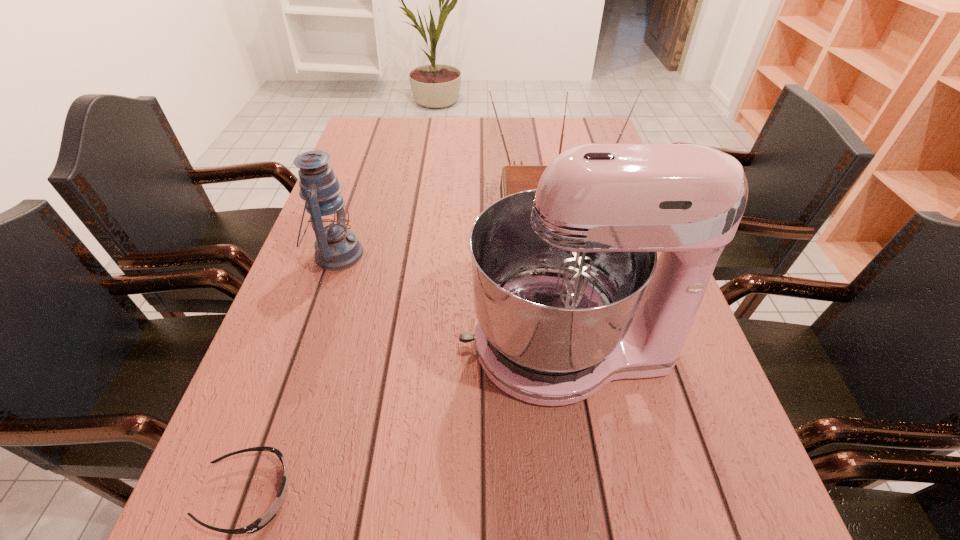
Find the location of a particular element. vacant point located between the nearest object and the radio_receiver is located at coordinates (400, 346).

Locate which object is the third closest to the lantern. Please provide its 2D coordinates. Your answer should be formatted as a tuple, i.e. [(x, y)], where the tuple contains the x and y coordinates of a point satisfying the conditions above.

[(260, 523)]

Find the location of `the closest object relative to the lantern`. the closest object relative to the lantern is located at coordinates (569, 295).

Identify the location of vacant region that satisfies the following two spatial constraints: 1. on the front panel of the radio_receiver; 2. on the front-facing side of the mixer. Image resolution: width=960 pixels, height=540 pixels. (581, 345).

At what (x,y) coordinates should I click in order to perform the action: click on vacant position in the image that satisfies the following two spatial constraints: 1. on the front panel of the radio_receiver; 2. on the front-facing side of the tallest object. Please return your answer as a coordinate pair (x, y). The height and width of the screenshot is (540, 960). Looking at the image, I should click on (581, 345).